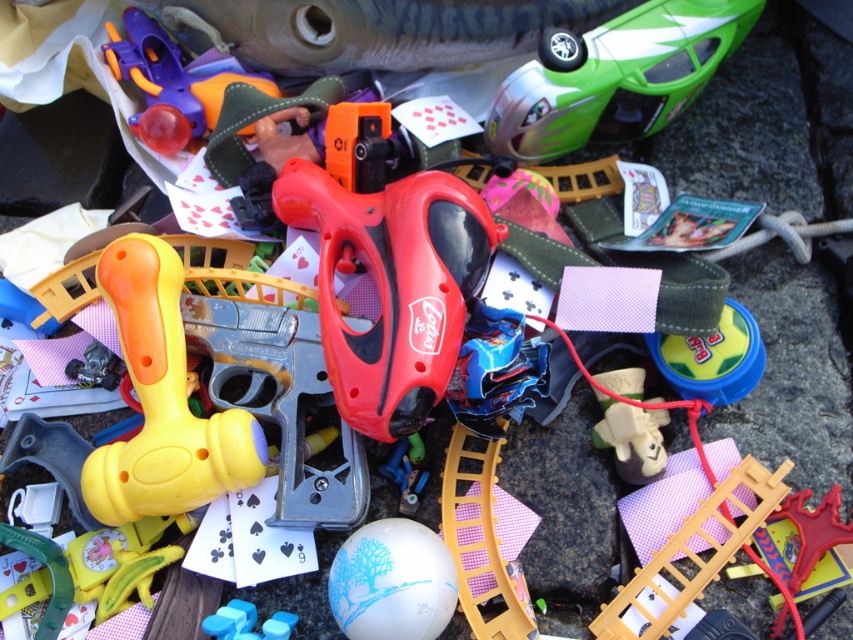
Question: Which point is closer to the camera taking this photo?

Choices:
 (A) (126, 244)
 (B) (618, 92)

Answer: (A)

Question: Does rubberized plastic toy gun at center have a lesser width compared to green plastic car at upper right?

Choices:
 (A) no
 (B) yes

Answer: (B)

Question: Can you confirm if green plastic car at upper right is smaller than white matte ball at center?

Choices:
 (A) no
 (B) yes

Answer: (A)

Question: Which point is farther to the camera?

Choices:
 (A) green plastic car at upper right
 (B) white matte ball at center
 (C) rubberized plastic toy gun at center

Answer: (A)

Question: Considering the relative positions of green plastic car at upper right and white matte ball at center in the image provided, where is green plastic car at upper right located with respect to white matte ball at center?

Choices:
 (A) right
 (B) left

Answer: (A)

Question: Which object is the farthest from the yellow plastic hammer at center-left?

Choices:
 (A) rubberized plastic toy gun at center
 (B) white matte ball at center
 (C) green plastic car at upper right

Answer: (C)